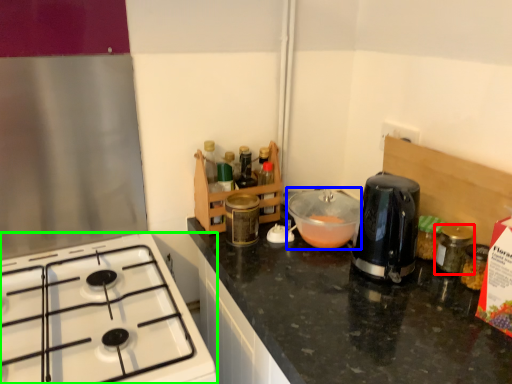
Question: Considering the real-world distances, which object is closest to bottle (highlighted by a red box)? bowl (highlighted by a blue box) or gas stove (highlighted by a green box).

Choices:
 (A) bowl
 (B) gas stove

Answer: (A)